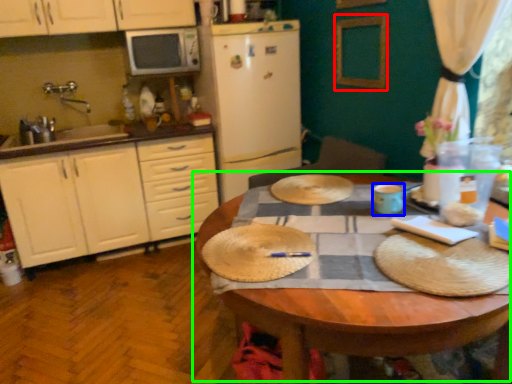
Question: Which object is positioned closest to picture frame (highlighted by a red box)? Select from coffee cup (highlighted by a blue box) and table (highlighted by a green box).

Choices:
 (A) coffee cup
 (B) table

Answer: (A)